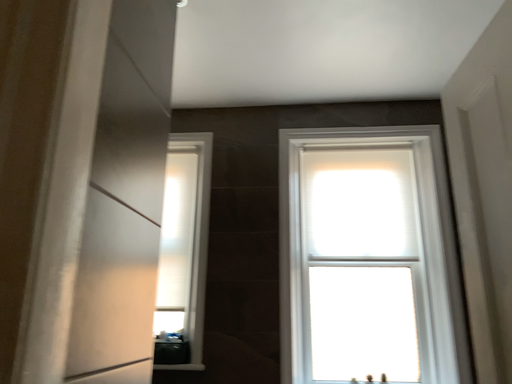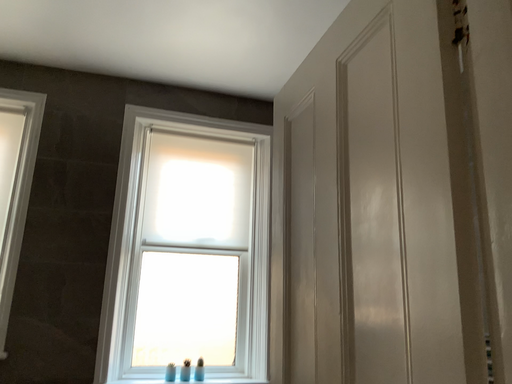
Question: Which way did the camera rotate in the video?

Choices:
 (A) rotated right
 (B) rotated left

Answer: (A)